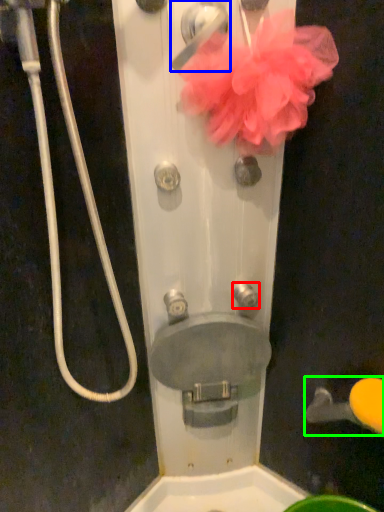
Question: Based on their relative distances, which object is nearer to knob (highlighted by a red box)? Choose from door handle (highlighted by a blue box) and door handle (highlighted by a green box).

Choices:
 (A) door handle
 (B) door handle

Answer: (B)